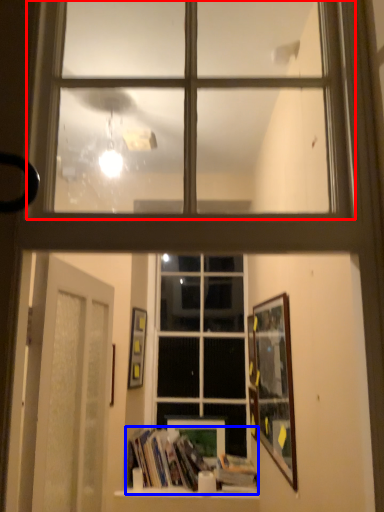
Question: Which of the following is the closest to the observer, window (highlighted by a red box) or book (highlighted by a blue box)?

Choices:
 (A) window
 (B) book

Answer: (A)